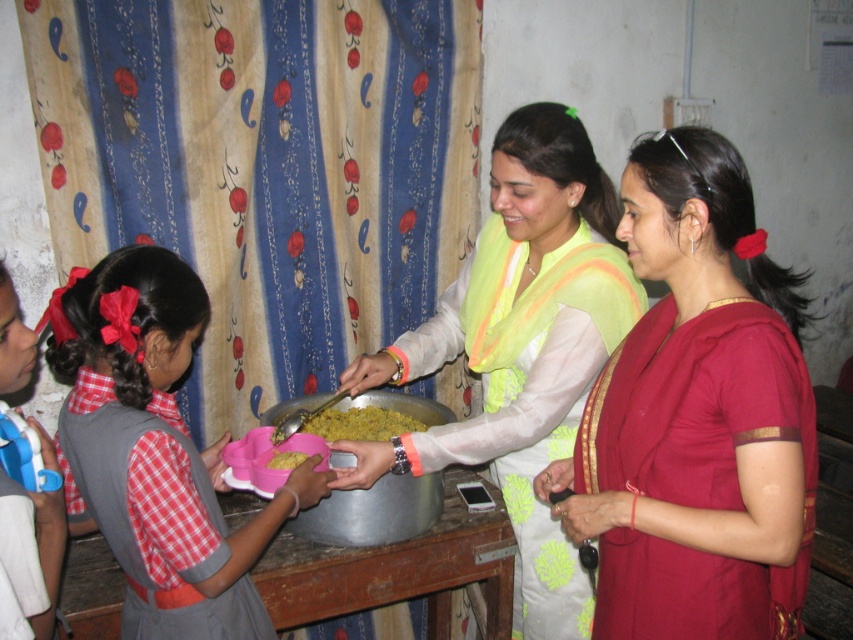
You are at the communal meal scene. You need to place a new decorative item on the table. Where exactly should you put it so that it is centered between the pink plastic tray at center and the large metal pot? Please provide coordinates in the format of point coordinates like point (374, 513).

The pink plastic tray at center is located at point (374, 513). To center the decorative item between it and the large metal pot, calculate the midpoint between these two points. However, the exact coordinates of the large metal pot are not provided, so precise placement requires knowing its position.

You are organizing a small event and need to place two sarees, the maroon silk saree at center and the light green silk saree at center, on a table. The table is only 12 inches wide. Can both sarees fit side by side on the table without overlapping?

The distance between the maroon silk saree at center and the light green silk saree at center is 13.24 inches. Since the table is only 12 inches wide, the sarees cannot fit side by side without overlapping.